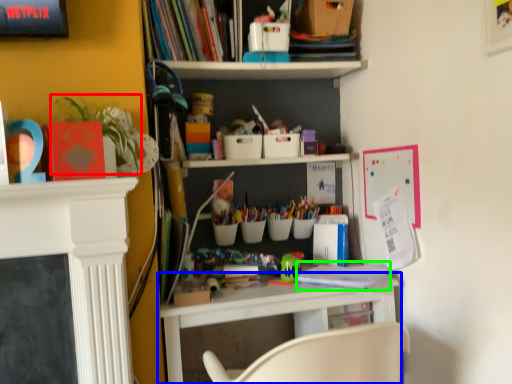
Question: Considering the real-world distances, which object is farthest from plant (highlighted by a red box)? shelf (highlighted by a blue box) or book (highlighted by a green box)?

Choices:
 (A) shelf
 (B) book

Answer: (B)